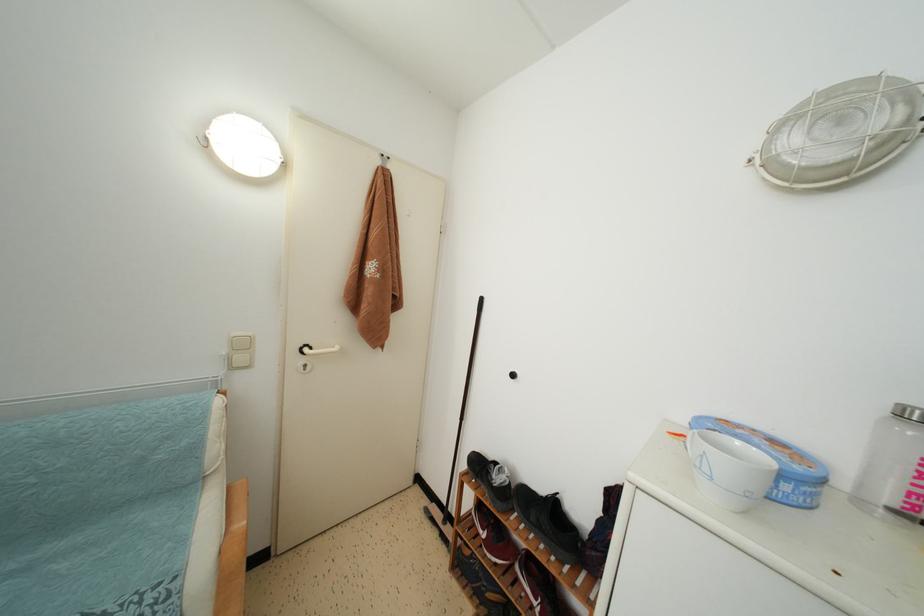
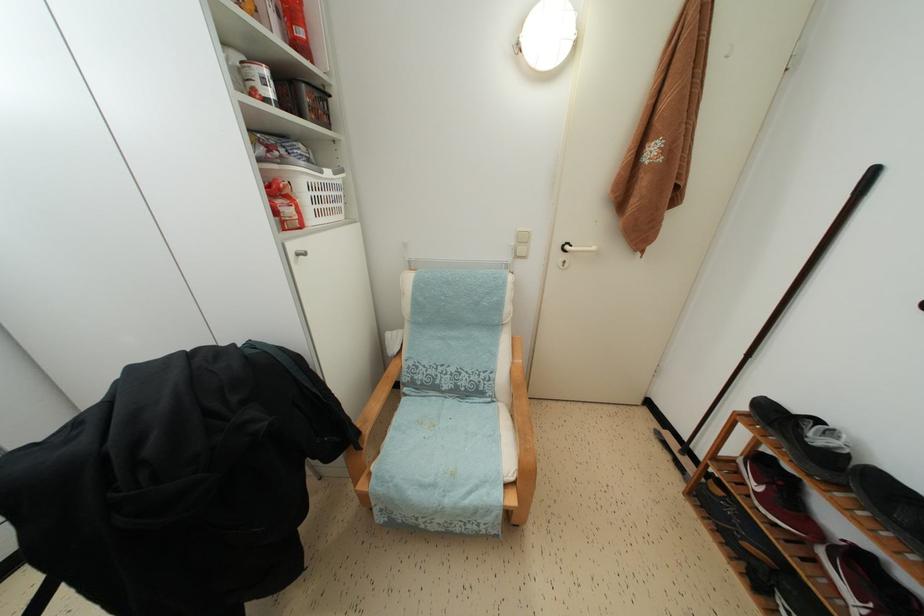
Locate, in the second image, the point that corresponds to pixel 369 312 in the first image.

(638, 207)